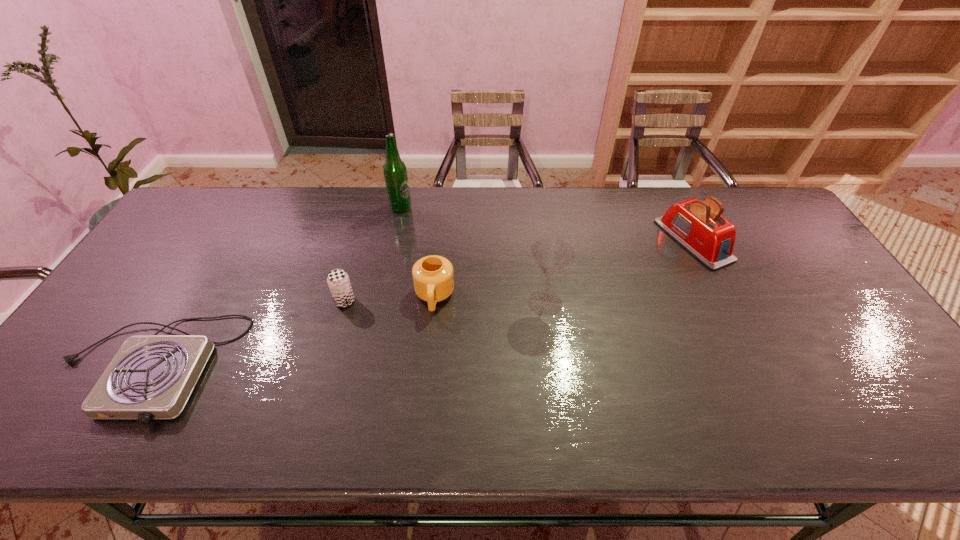
Where is `free space between the beer can and the toaster`? Image resolution: width=960 pixels, height=540 pixels. free space between the beer can and the toaster is located at coordinates (519, 271).

At what (x,y) coordinates should I click in order to perform the action: click on vacant point located between the second tallest object and the tallest object. Please return your answer as a coordinate pair (x, y). The width and height of the screenshot is (960, 540). Looking at the image, I should click on (473, 255).

You are a GUI agent. You are given a task and a screenshot of the screen. Output one action in this format:
    pyautogui.click(x=<x>, y=<y>)
    Task: Click on the free space between the flute glass and the tallest object
    
    Given the screenshot: What is the action you would take?
    pyautogui.click(x=473, y=255)

Where is `free space between the fifth shortest object and the fourth object from right to left`? The image size is (960, 540). free space between the fifth shortest object and the fourth object from right to left is located at coordinates (473, 255).

Find the location of `free point between the flute glass and the mug`. free point between the flute glass and the mug is located at coordinates coord(490,300).

Find the location of `object identified as the third closest to the second object from right to left`. object identified as the third closest to the second object from right to left is located at coordinates (338, 281).

Choose which object is the third nearest neighbor to the rightmost object. Please provide its 2D coordinates. Your answer should be formatted as a tuple, i.e. [(x, y)], where the tuple contains the x and y coordinates of a point satisfying the conditions above.

[(395, 172)]

Where is `free location that satisfies the following two spatial constraints: 1. on the handle side of the mug; 2. on the right side of the flute glass`? This screenshot has width=960, height=540. free location that satisfies the following two spatial constraints: 1. on the handle side of the mug; 2. on the right side of the flute glass is located at coordinates (434, 303).

In order to click on free region that satisfies the following two spatial constraints: 1. on the label of the third object from left to right; 2. on the back side of the flute glass in this screenshot , I will do `click(381, 303)`.

Locate an element on the screen. free location that satisfies the following two spatial constraints: 1. on the back side of the flute glass; 2. on the label of the third object from left to right is located at coordinates (532, 207).